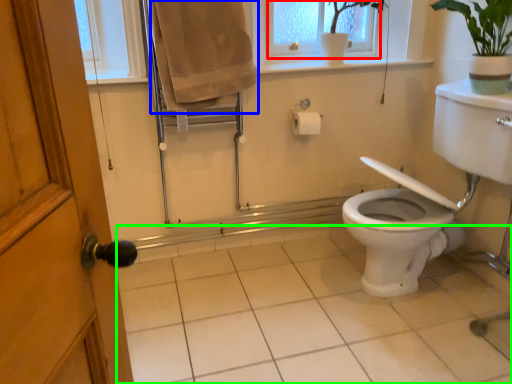
Question: Which object is positioned closest to window frame (highlighted by a red box)? Select from bath towel (highlighted by a blue box) and plain (highlighted by a green box).

Choices:
 (A) bath towel
 (B) plain

Answer: (A)